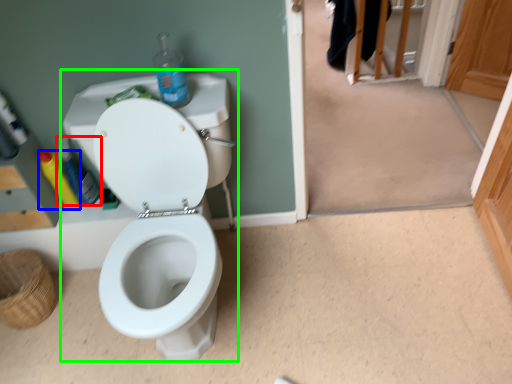
Question: Based on their relative distances, which object is farther from bottle (highlighted by a red box)? Choose from bottle (highlighted by a blue box) and sink (highlighted by a green box).

Choices:
 (A) bottle
 (B) sink

Answer: (B)